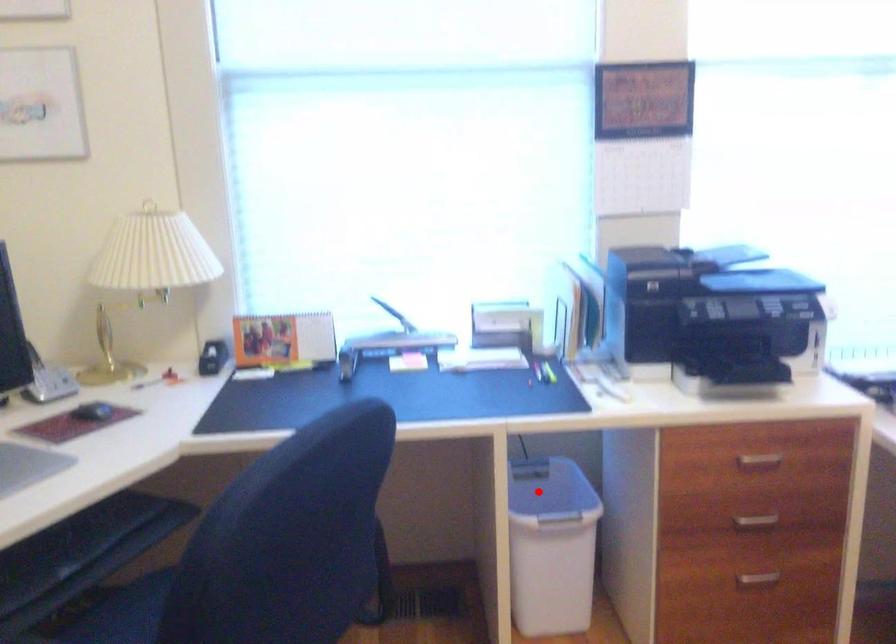
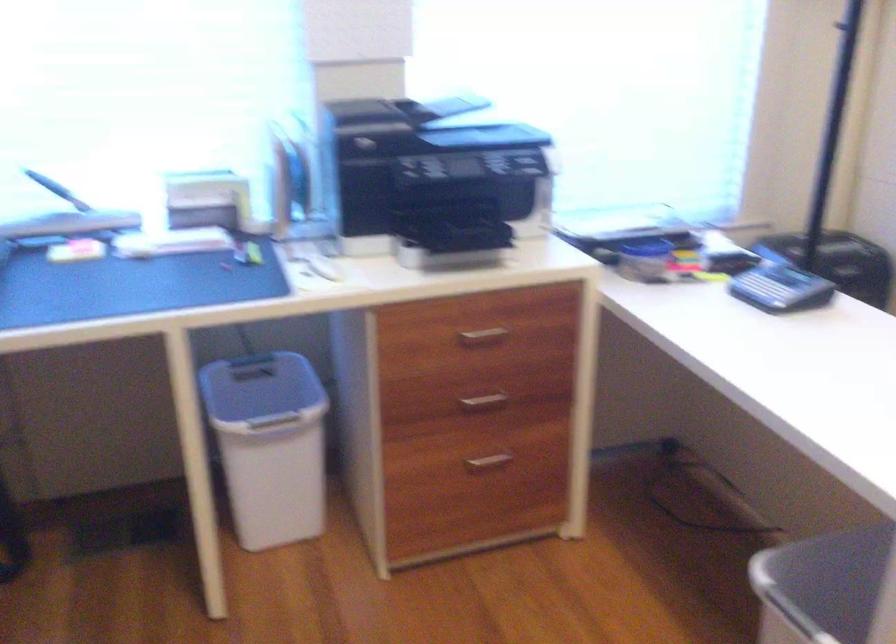
Question: I am providing you with two images of the same scene from different viewpoints. In image1, a red point is highlighted. Considering the same 3D point in image2, which of the following is correct?

Choices:
 (A) It is closer
 (B) It is farther

Answer: (A)